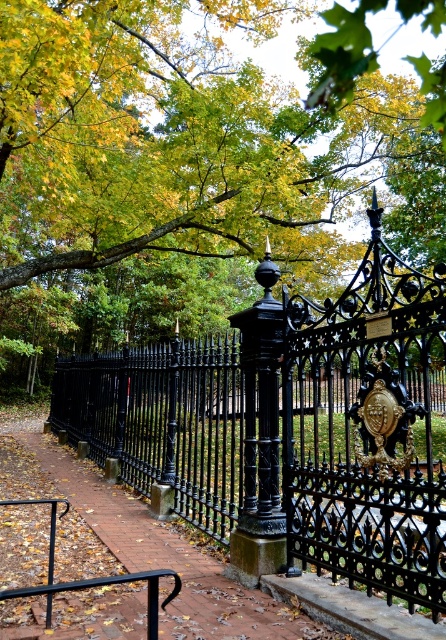
You are standing in front of the black wrought iron fence with the slightly ajar central gate. You notice a green leafy tree at upper center. Based on the coordinates provided, can you determine if the tree is positioned to the left or right of the central gate?

The green leafy tree at upper center is located at point 0.266 on the x and 0.419 on the y. Since the central gate is at the middle of the fence, the tree is positioned to the left of the central gate as its x coordinate is less than 0.5.

You are a painter who wants to capture the scene of the green leafy tree at upper center and the black wrought iron fence at center in your painting. Which object should you focus on first if you want to paint the taller one?

The green leafy tree at upper center is much taller than the black wrought iron fence at center, so you should focus on painting the green leafy tree at upper center first.